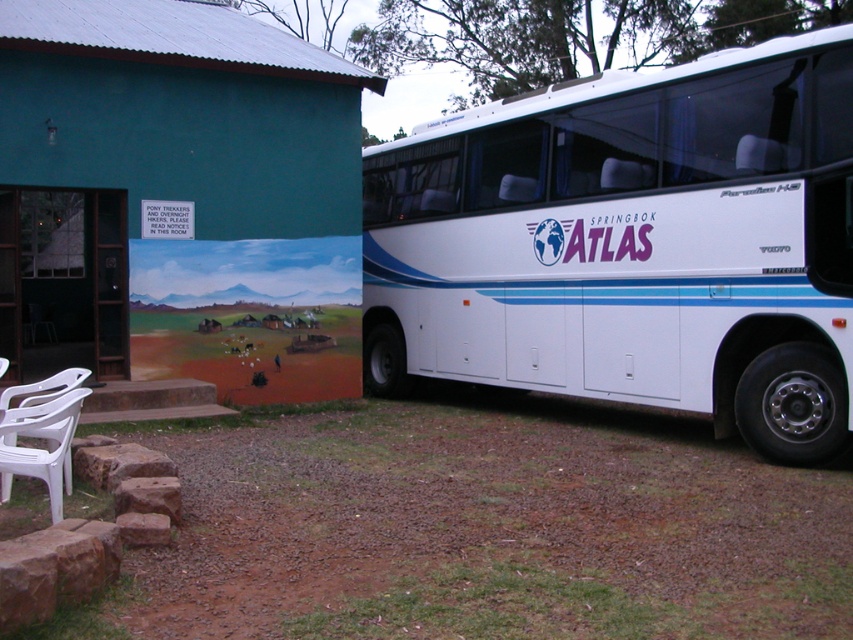
Question: In this image, where is teal painted wall at upper left located relative to white plastic chair at lower left?

Choices:
 (A) right
 (B) left

Answer: (B)

Question: Which object is the closest to the teal painted wall at upper left?

Choices:
 (A) white plastic chair at lower left
 (B) white glossy/decorative bus at right

Answer: (B)

Question: Which is nearer to the white plastic chair at lower left?

Choices:
 (A) teal painted wall at upper left
 (B) white glossy/decorative bus at right

Answer: (B)

Question: Where is white glossy/decorative bus at right located in relation to teal painted wall at upper left in the image?

Choices:
 (A) right
 (B) left

Answer: (A)

Question: Is white glossy/decorative bus at right wider than teal painted wall at upper left?

Choices:
 (A) yes
 (B) no

Answer: (B)

Question: Among these points, which one is farthest from the camera?

Choices:
 (A) (1, 428)
 (B) (579, 346)

Answer: (B)